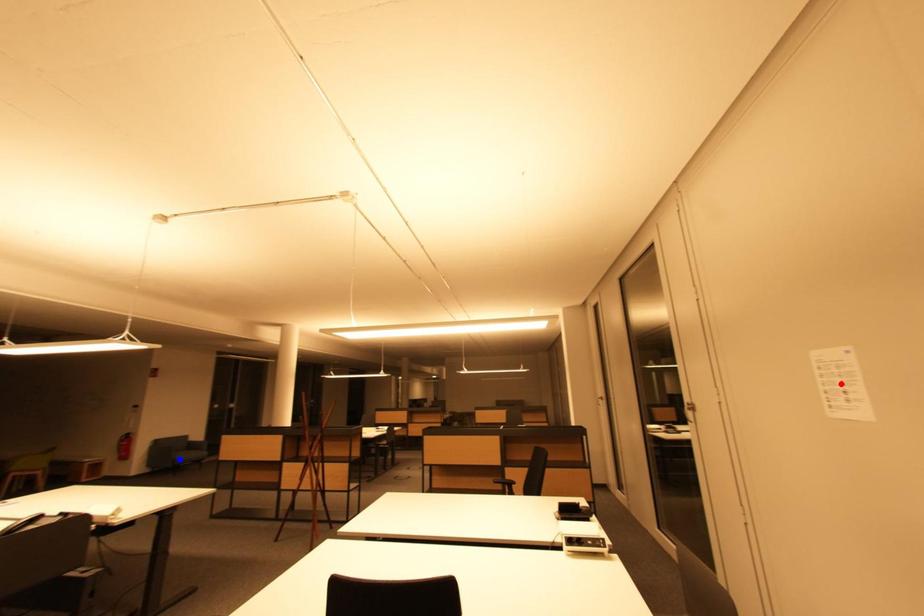
Question: Two points are marked on the image. Which point is closer to the camera?

Choices:
 (A) Blue point is closer.
 (B) Red point is closer.

Answer: (B)